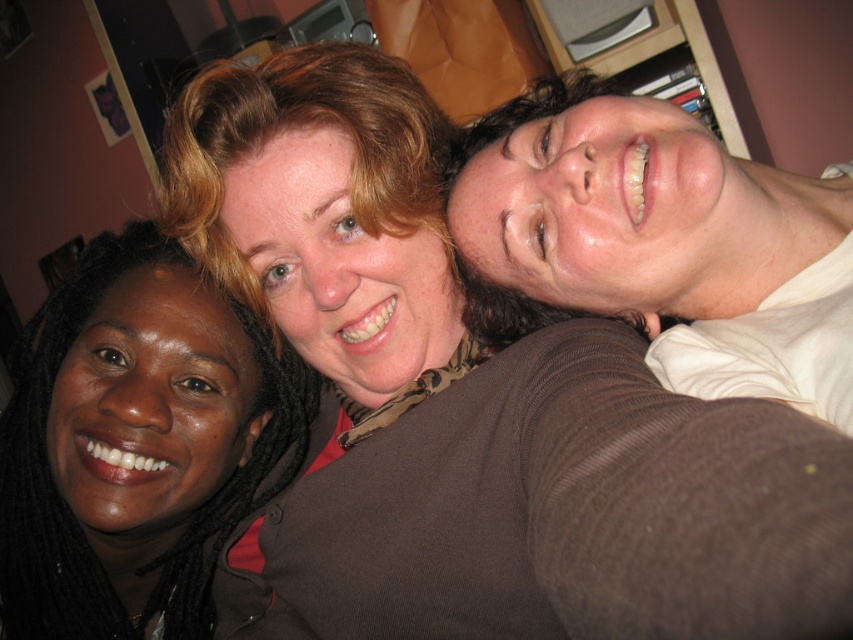
Question: Does matte brown sweater at upper left come behind matte brown sweater at upper right?

Choices:
 (A) yes
 (B) no

Answer: (A)

Question: Is matte brown sweater at upper left to the right of matte brown sweater at upper right from the viewer's perspective?

Choices:
 (A) no
 (B) yes

Answer: (A)

Question: From the image, what is the correct spatial relationship of matte brown sweater at upper left in relation to matte brown sweater at upper right?

Choices:
 (A) left
 (B) right

Answer: (A)

Question: Which point is closer to the camera?

Choices:
 (A) (618, 292)
 (B) (4, 492)

Answer: (A)

Question: Which object is farther from the camera taking this photo?

Choices:
 (A) matte brown sweater at upper left
 (B) matte brown sweater at upper right

Answer: (A)